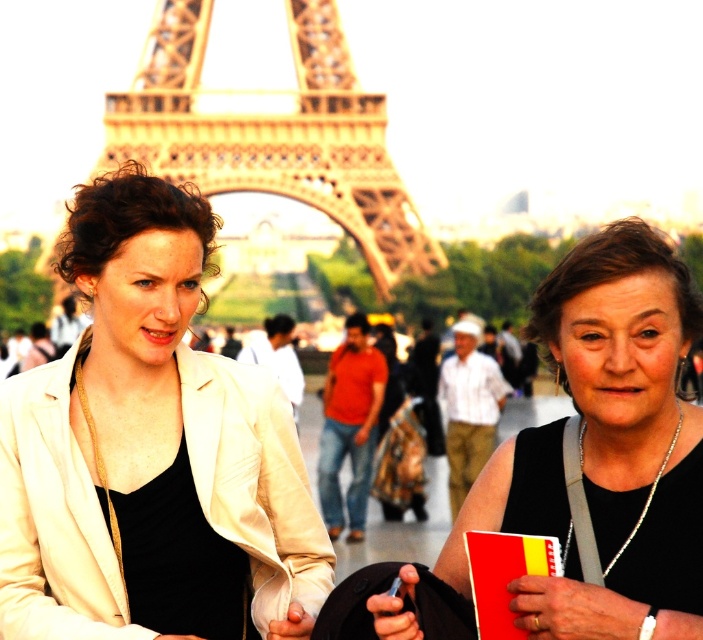
You are a photographer standing at the Eiffel Tower base and see the matte white jacket at center and the black matte dress at center. Which one is positioned more to the left side?

The matte white jacket at center is positioned more to the left side than the black matte dress at center.

Consider the image. You are a photographer planning to take a photo of the golden metallic Eiffel Tower at center and the black matte dress at center. Since you want to focus on the Eiffel Tower, which object should you ensure is in the foreground?

The black matte dress at center should be in the foreground because it is positioned under the golden metallic Eiffel Tower at center, meaning it is closer to the camera.